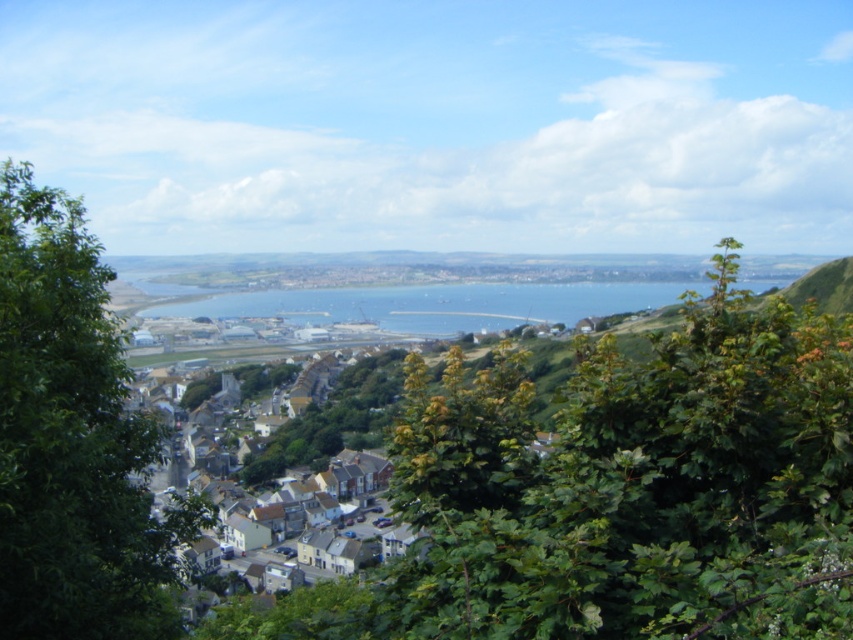
Describe the element at coordinates (73, 440) in the screenshot. The width and height of the screenshot is (853, 640). I see `green leafy tree at left` at that location.

Does green leafy tree at left have a lesser height compared to white matte houses at center?

No.

Locate an element on the screen. Image resolution: width=853 pixels, height=640 pixels. green leafy tree at left is located at coordinates (73, 440).